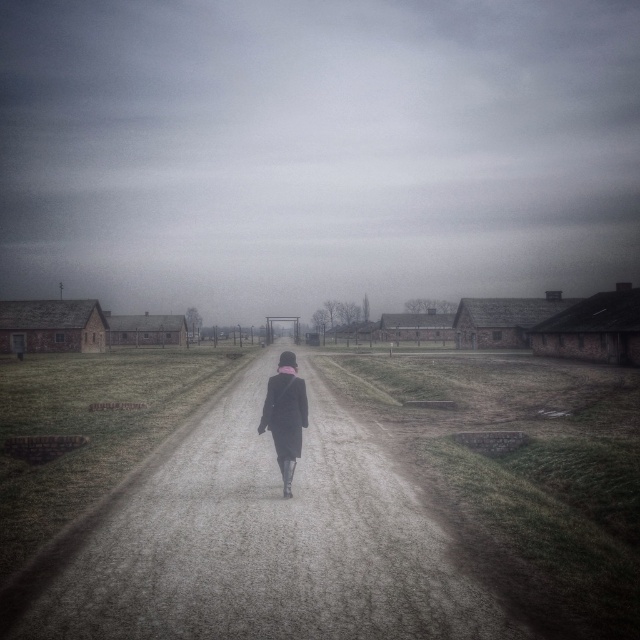
Between gray fog at center and dirt road at center, which one is positioned lower?

dirt road at center

From the picture: Is gray fog at center positioned at the back of dirt road at center?

Yes, gray fog at center is behind dirt road at center.

This screenshot has height=640, width=640. Identify the location of gray fog at center. (316, 150).

Can you confirm if gray fog at center is shorter than dark gray coat at center?

No.

Identify the location of gray fog at center. The image size is (640, 640). (316, 150).

Where is `gray fog at center`? This screenshot has width=640, height=640. gray fog at center is located at coordinates (316, 150).

Can you confirm if dirt road at center is wider than dark gray coat at center?

Yes.

Between dirt road at center and dark gray coat at center, which one has more height?

Standing taller between the two is dark gray coat at center.

Image resolution: width=640 pixels, height=640 pixels. In order to click on dirt road at center in this screenshot , I will do click(260, 541).